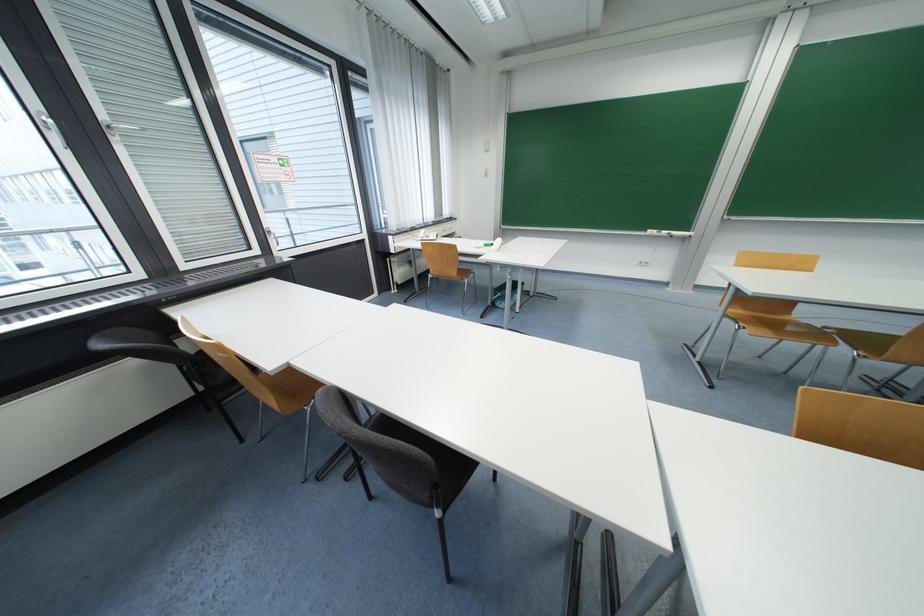
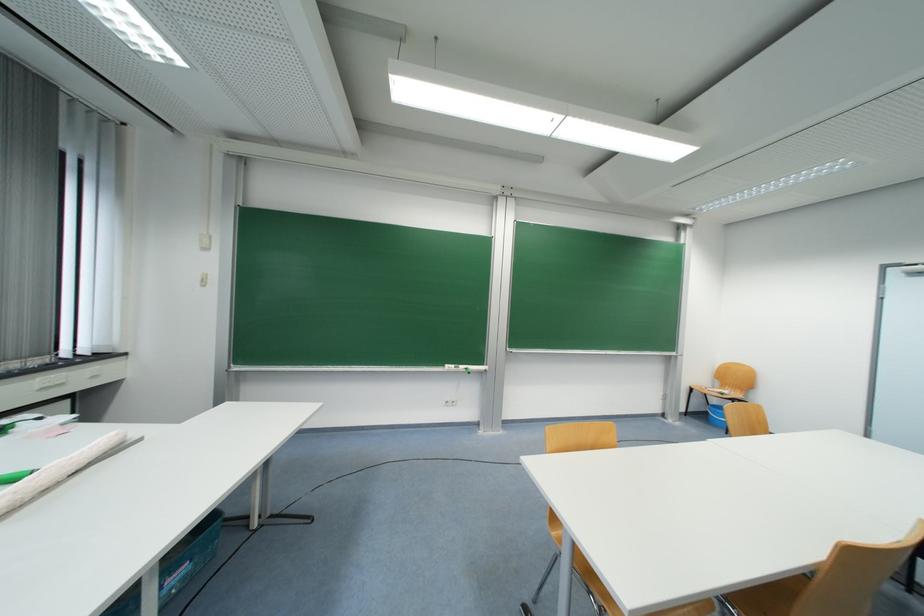
In the second image, find the point that corresponds to [670,233] in the first image.

(467, 369)